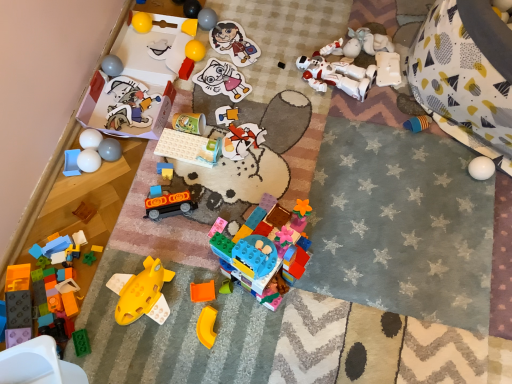
In order to click on vacant area that lies between white plastic robot at upper right, which appears as the second toy when viewed from the right, and yellow matte plastic piece at center, the seventh toy when ordered from right to left in this screenshot , I will do `click(321, 170)`.